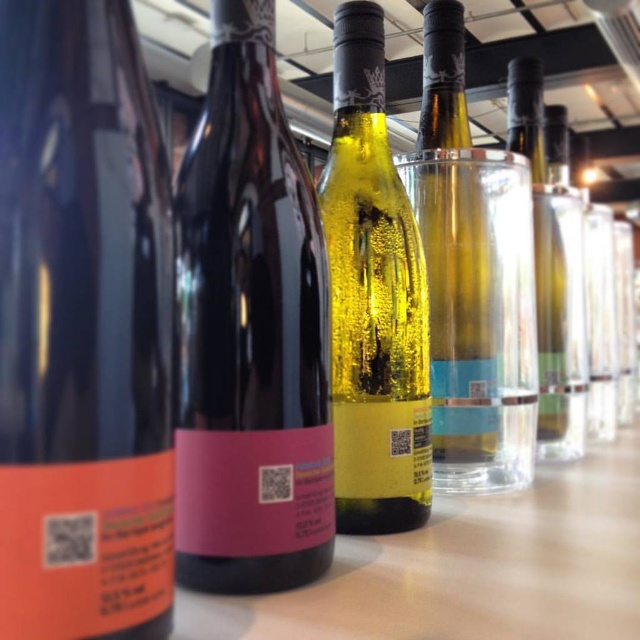
Question: Does shiny black bottle at center appear under translucent yellow glass bottle at center?

Choices:
 (A) no
 (B) yes

Answer: (B)

Question: Where is translucent yellow glass bottle at center located in relation to translucent glass bottle at center in the image?

Choices:
 (A) right
 (B) left

Answer: (B)

Question: Which point appears farthest from the camera in this image?

Choices:
 (A) (61, 625)
 (B) (451, 140)
 (C) (220, 184)

Answer: (B)

Question: Which of these objects is positioned closest to the clear glass bottle at right?

Choices:
 (A) shiny black bottle at center
 (B) matte black bottle at center

Answer: (B)

Question: Can you confirm if translucent yellow glass bottle at center is positioned to the right of translucent glass bottle at center?

Choices:
 (A) no
 (B) yes

Answer: (A)

Question: Considering the real-world distances, which object is farthest from the translucent yellow glass bottle at center?

Choices:
 (A) shiny black bottle at center
 (B) matte black bottle at center

Answer: (A)